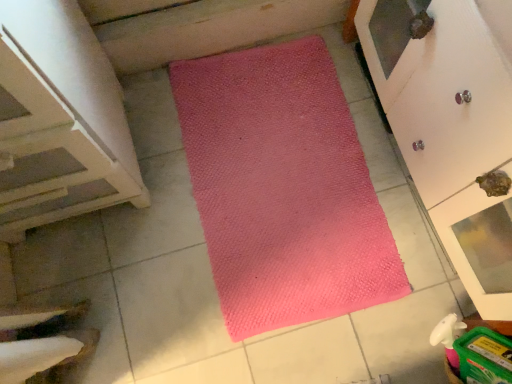
Locate an element on the screen. The height and width of the screenshot is (384, 512). vacant space in between white wood stairs at left and pink textured mat at center is located at coordinates (133, 242).